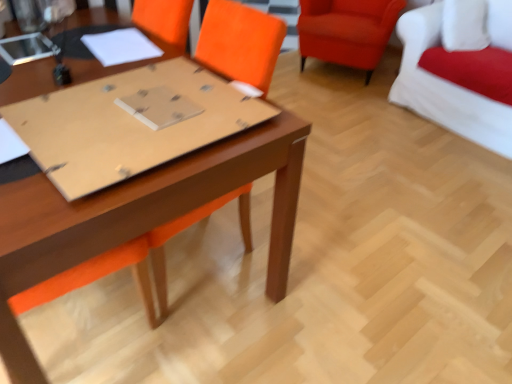
The image size is (512, 384). Identify the location of vacant area that is situated to the right of matte brown table at center. (361, 249).